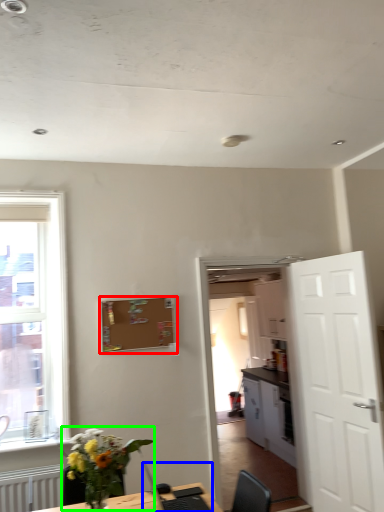
Question: Considering the real-world distances, which object is closest to bulletin board (highlighted by a red box)? computer (highlighted by a blue box) or houseplant (highlighted by a green box).

Choices:
 (A) computer
 (B) houseplant

Answer: (A)